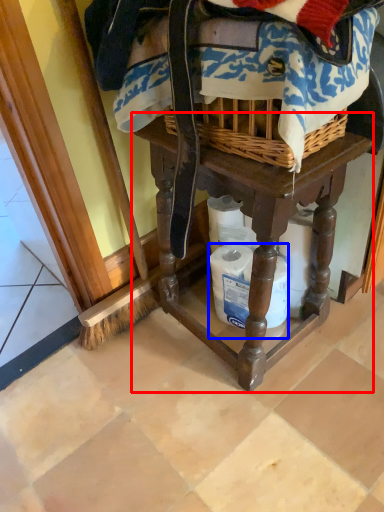
Question: Which of the following is the farthest to the observer, furniture (highlighted by a red box) or toilet paper (highlighted by a blue box)?

Choices:
 (A) furniture
 (B) toilet paper

Answer: (B)